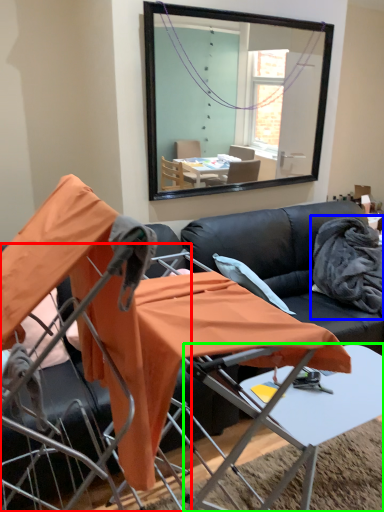
Question: Which object is positioned closest to chair (highlighted by a red box)? Select from fabric (highlighted by a blue box) and table (highlighted by a green box).

Choices:
 (A) fabric
 (B) table

Answer: (B)